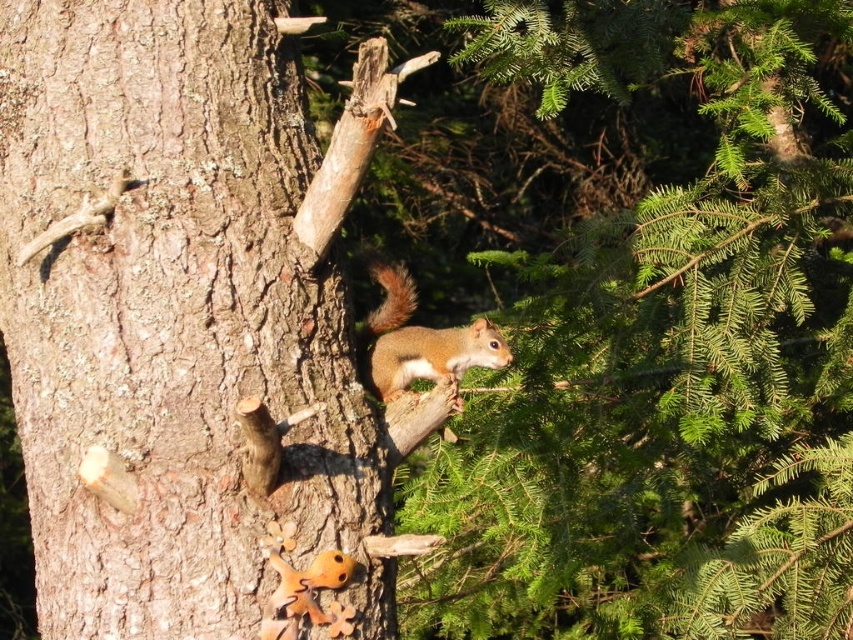
You are a bird flying over the natural outdoor setting. You see the rough bark tree trunk at center and the brown fuzzy tail at upper center. Which object is taller?

The rough bark tree trunk at center is much taller than the brown fuzzy tail at upper center.

You are a photographer trying to capture the shiny brown squirrel at center and the brown fuzzy tail at upper center in the same frame. Given that your camera has a minimum focus distance of 3 inches, will you be able to focus on both subjects simultaneously?

The shiny brown squirrel at center and the brown fuzzy tail at upper center are 2.80 inches apart from each other. Since the distance between them is less than the camera minimum focus distance of 3 inches, the camera can focus on both subjects simultaneously.

You are a bird flying towards the rough bark tree trunk at center and the shiny brown squirrel at center. Which object will you reach first?

The rough bark tree trunk at center is in front of the shiny brown squirrel at center, so you will reach the rough bark tree trunk at center first.